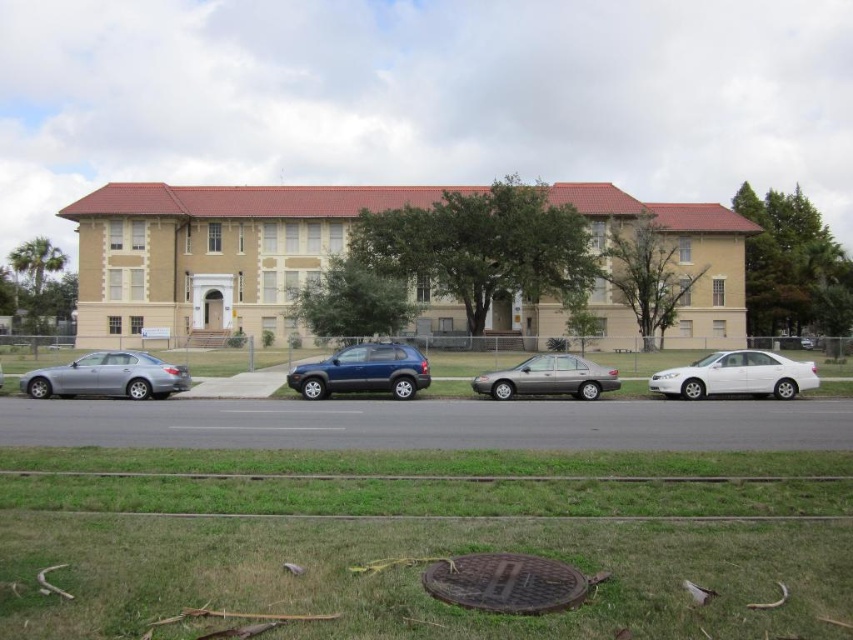
You are a delivery person who needs to park your 15 feet long truck between the two satin silver sedan at left and satin silver sedan at center. Can you fit your truck in the space between them?

The distance between the satin silver sedan at left and satin silver sedan at center is 37.94 feet. Since your truck is 15 feet long, there is enough space to park it between them.

You are a delivery driver who needs to park your vehicle in the grassy area in front of the building. The grassy area is enclosed by a chain link fence. You have a vehicle that is the same size as the satin silver sedan at center. Can you park your vehicle in the same spot where the matte blue suv at center is currently parked?

The matte blue suv at center has a smaller size compared to satin silver sedan at center. Since your vehicle is the same size as the satin silver sedan at center, which is larger than the matte blue suv at center, it might not fit in the same spot where the matte blue suv at center is parked.